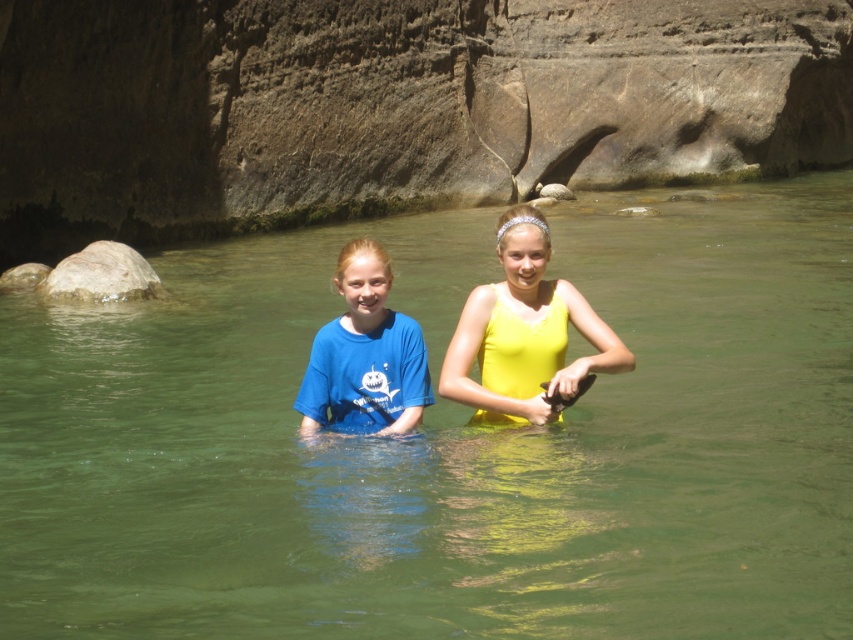
Looking at this image, who is lower down, green translucent water at center or yellow matte tank top at center?

Positioned lower is green translucent water at center.

Locate an element on the screen. This screenshot has width=853, height=640. green translucent water at center is located at coordinates (447, 442).

Which is in front, point (199, 364) or point (529, 392)?

Point (529, 392) is more forward.

Locate an element on the screen. The width and height of the screenshot is (853, 640). green translucent water at center is located at coordinates (447, 442).

You are a GUI agent. You are given a task and a screenshot of the screen. Output one action in this format:
    pyautogui.click(x=<x>, y=<y>)
    Task: Click on the yellow matte tank top at center
    This screenshot has width=853, height=640.
    Given the screenshot: What is the action you would take?
    pyautogui.click(x=524, y=332)

Is yellow matte tank top at center wider than matte blue t-shirt at center?

Indeed, yellow matte tank top at center has a greater width compared to matte blue t-shirt at center.

Locate an element on the screen. This screenshot has height=640, width=853. yellow matte tank top at center is located at coordinates (524, 332).

Identify the location of yellow matte tank top at center. The width and height of the screenshot is (853, 640). (524, 332).

Who is positioned more to the left, yellow matte tank top at center or smooth gray rock at left?

smooth gray rock at left is more to the left.

Does yellow matte tank top at center have a greater width compared to smooth gray rock at left?

Correct, the width of yellow matte tank top at center exceeds that of smooth gray rock at left.

Does point (509, 417) lie behind point (138, 296)?

That is False.

You are a GUI agent. You are given a task and a screenshot of the screen. Output one action in this format:
    pyautogui.click(x=<x>, y=<y>)
    Task: Click on the yellow matte tank top at center
    The image size is (853, 640).
    Given the screenshot: What is the action you would take?
    pyautogui.click(x=524, y=332)